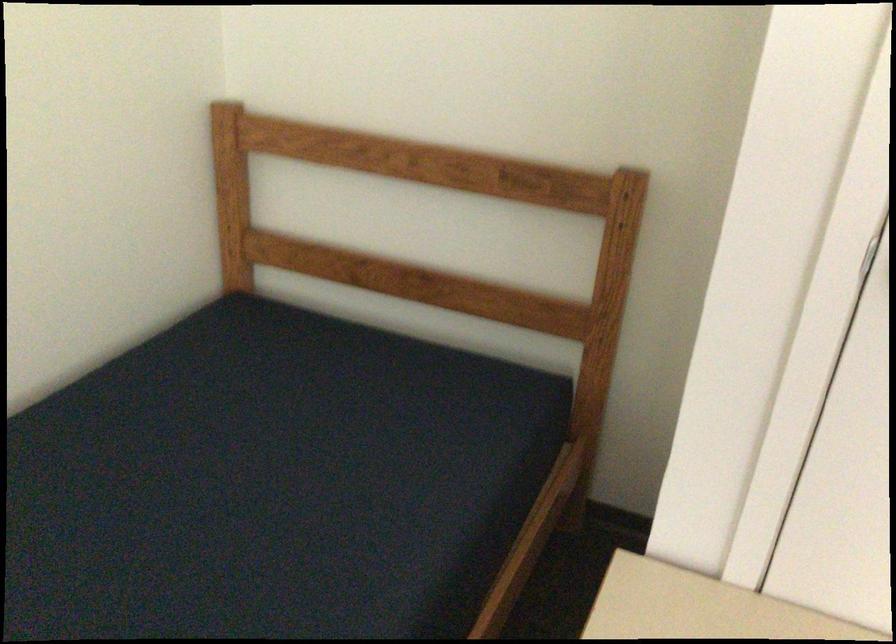
The height and width of the screenshot is (644, 896). Describe the element at coordinates (273, 484) in the screenshot. I see `the black mattress surface` at that location.